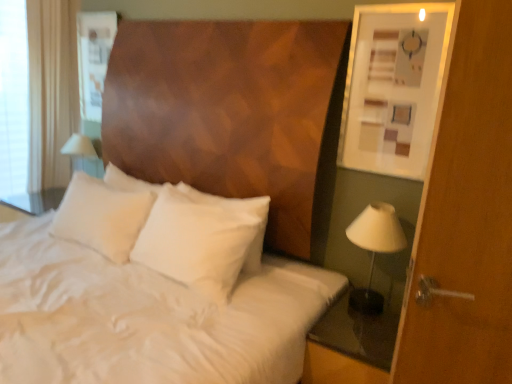
Locate an element on the screen. The image size is (512, 384). transparent glass nightstand at lower right is located at coordinates (350, 346).

What do you see at coordinates (14, 100) in the screenshot? The height and width of the screenshot is (384, 512). I see `white fabric at left` at bounding box center [14, 100].

What do you see at coordinates (146, 318) in the screenshot? This screenshot has width=512, height=384. I see `white satin bedsheet at center` at bounding box center [146, 318].

Measure the distance between white soft pillow at center and camera.

A distance of 1.92 meters exists between white soft pillow at center and camera.

Locate an element on the screen. The height and width of the screenshot is (384, 512). white fabric lampshade at right is located at coordinates (374, 249).

Describe the element at coordinates (374, 249) in the screenshot. Image resolution: width=512 pixels, height=384 pixels. I see `white fabric lampshade at right` at that location.

Identify the location of transparent glass nightstand at lower right. (350, 346).

Is white satin bedsheet at center to the left or to the right of white soft pillow at center in the image?

white satin bedsheet at center is to the left of white soft pillow at center.

Considering the relative sizes of white satin bedsheet at center and white soft pillow at center in the image provided, is white satin bedsheet at center thinner than white soft pillow at center?

Incorrect, the width of white satin bedsheet at center is not less than that of white soft pillow at center.

Is white satin bedsheet at center positioned before white soft pillow at center?

Yes, the depth of white satin bedsheet at center is less than that of white soft pillow at center.

Can you confirm if white satin bedsheet at center is bigger than white soft pillow at center?

Correct, white satin bedsheet at center is larger in size than white soft pillow at center.

From the image's perspective, does transparent glass nightstand at lower right appear lower than matte white picture frame at upper right?

Yes, from the image's perspective, transparent glass nightstand at lower right is below matte white picture frame at upper right.

Where is `picture frame behind the transparent glass nightstand at lower right`? The width and height of the screenshot is (512, 384). picture frame behind the transparent glass nightstand at lower right is located at coordinates (393, 87).

Looking at this image, from a real-world perspective, who is located lower, transparent glass nightstand at lower right or matte white picture frame at upper right?

From a 3D spatial view, transparent glass nightstand at lower right is below.

Is matte white picture frame at upper right located within transparent glass nightstand at lower right?

No.

In terms of width, does white fabric lampshade at right look wider or thinner when compared to white soft pillow at center?

Clearly, white fabric lampshade at right has more width compared to white soft pillow at center.

Locate an element on the screen. bedside lamp on the right of the white soft pillow at center is located at coordinates (374, 249).

From a real-world perspective, which is physically above, white fabric lampshade at right or white soft pillow at center?

In real-world perspective, white soft pillow at center is above.

Between white fabric at left and transparent glass nightstand at lower right, which one has larger width?

Wider between the two is transparent glass nightstand at lower right.

Looking at this image, from the image's perspective, which object appears higher, white fabric at left or transparent glass nightstand at lower right?

white fabric at left appears higher in the image.

Considering the sizes of white fabric at left and transparent glass nightstand at lower right in the image, is white fabric at left taller or shorter than transparent glass nightstand at lower right?

white fabric at left is taller than transparent glass nightstand at lower right.

From the picture: Can you confirm if white fabric lampshade at right is wider than white satin bedsheet at center?

Incorrect, the width of white fabric lampshade at right does not surpass that of white satin bedsheet at center.

Can you confirm if white fabric lampshade at right is taller than white satin bedsheet at center?

No, white fabric lampshade at right is not taller than white satin bedsheet at center.

Is point (364, 309) closer to camera compared to point (67, 286)?

That is False.

Is transparent glass nightstand at lower right shorter than white soft pillow at center?

Yes.

Considering the positions of points (304, 371) and (144, 187), is point (304, 371) closer to camera compared to point (144, 187)?

That is True.

Is transparent glass nightstand at lower right positioned with its back to white soft pillow at center?

That's not correct — transparent glass nightstand at lower right is not looking away from white soft pillow at center.

Is transparent glass nightstand at lower right thinner than white soft pillow at center?

No, transparent glass nightstand at lower right is not thinner than white soft pillow at center.

Is white fabric lampshade at right taller or shorter than white fabric at left?

white fabric lampshade at right is shorter than white fabric at left.

From the image's perspective, does white fabric lampshade at right appear higher than white fabric at left?

No, from the image's perspective, white fabric lampshade at right is not over white fabric at left.

Based on the photo, is white fabric lampshade at right looking in the opposite direction of white fabric at left?

white fabric lampshade at right does not have its back to white fabric at left.

Would you say white fabric lampshade at right is a long distance from white fabric at left?

Yes, white fabric lampshade at right and white fabric at left are quite far apart.

Where is `pillow above the white satin bedsheet at center (from the image's perspective)`? The image size is (512, 384). pillow above the white satin bedsheet at center (from the image's perspective) is located at coordinates (237, 210).

Locate an element on the screen. The image size is (512, 384). nightstand in front of the matte white picture frame at upper right is located at coordinates (350, 346).

Based on their spatial positions, is white fabric lampshade at right or transparent glass nightstand at lower right closer to white soft pillow at center?

Based on the image, white fabric lampshade at right appears to be nearer to white soft pillow at center.

Which object lies further to the anchor point white fabric lampshade at right, white soft pillow at center or white fabric at left?

Based on the image, white fabric at left appears to be further to white fabric lampshade at right.

Based on their spatial positions, is matte white picture frame at upper right or transparent glass nightstand at lower right closer to white satin bedsheet at center?

transparent glass nightstand at lower right is closer to white satin bedsheet at center.

Looking at the image, which one is located closer to white soft pillow at center, transparent glass nightstand at lower right or white satin bedsheet at center?

white satin bedsheet at center lies closer to white soft pillow at center than the other object.

Estimate the real-world distances between objects in this image. Which object is closer to white fabric lampshade at right, white fabric at left or matte white picture frame at upper right?

Based on the image, matte white picture frame at upper right appears to be nearer to white fabric lampshade at right.

Estimate the real-world distances between objects in this image. Which object is closer to matte white picture frame at upper right, white fabric lampshade at right or white fabric at left?

white fabric lampshade at right lies closer to matte white picture frame at upper right than the other object.

Based on their spatial positions, is white soft pillow at center or matte white picture frame at upper right closer to white fabric at left?

white soft pillow at center lies closer to white fabric at left than the other object.

When comparing their distances from transparent glass nightstand at lower right, does white fabric lampshade at right or white satin bedsheet at center seem closer?

Among the two, white satin bedsheet at center is located nearer to transparent glass nightstand at lower right.

You are a GUI agent. You are given a task and a screenshot of the screen. Output one action in this format:
    pyautogui.click(x=<x>, y=<y>)
    Task: Click on the pillow between white satin bedsheet at center and white fabric at left along the z-axis
    Image resolution: width=512 pixels, height=384 pixels.
    Given the screenshot: What is the action you would take?
    pyautogui.click(x=237, y=210)

Locate an element on the screen. This screenshot has height=384, width=512. nightstand situated between white fabric at left and matte white picture frame at upper right from left to right is located at coordinates (350, 346).

At what (x,y) coordinates should I click in order to perform the action: click on pillow between matte white picture frame at upper right and transparent glass nightstand at lower right from top to bottom. Please return your answer as a coordinate pair (x, y). The width and height of the screenshot is (512, 384). Looking at the image, I should click on (237, 210).

The image size is (512, 384). In order to click on nightstand between white satin bedsheet at center and white fabric lampshade at right in the horizontal direction in this screenshot , I will do `click(350, 346)`.